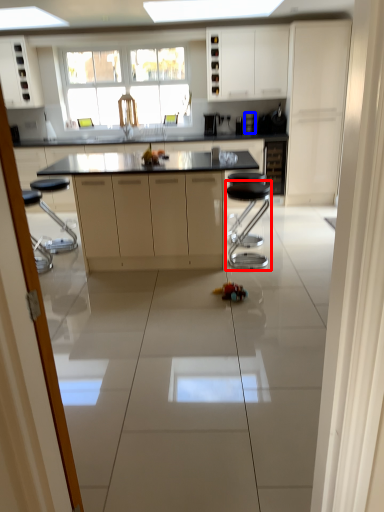
Question: Which object is further to the camera taking this photo, bar stool (highlighted by a red box) or appliance (highlighted by a blue box)?

Choices:
 (A) bar stool
 (B) appliance

Answer: (B)